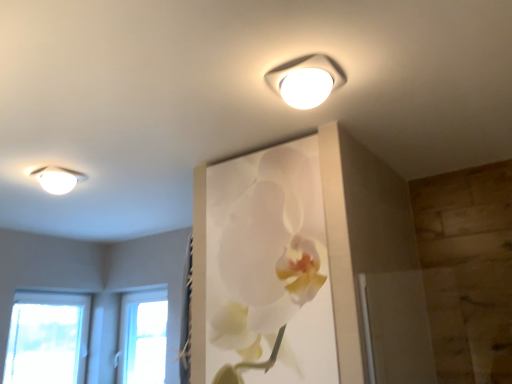
Identify the location of white plastic lamp at upper center, placed as the first lamp when sorted from right to left. The image size is (512, 384). (306, 80).

The height and width of the screenshot is (384, 512). Identify the location of transparent glass window at lower left. (142, 338).

Locate an element on the screen. Image resolution: width=512 pixels, height=384 pixels. white glossy ceiling light at upper left, the first lamp in the left-to-right sequence is located at coordinates (58, 178).

The image size is (512, 384). I want to click on white matte orchid at upper center, so click(269, 266).

Image resolution: width=512 pixels, height=384 pixels. What are the coordinates of `white plastic lamp at upper center, positioned as the second lamp in back-to-front order` in the screenshot? It's located at (306, 80).

From the picture: From a real-world perspective, who is located higher, white glossy ceiling light at upper left, the first lamp in the left-to-right sequence, or transparent glass window at lower left?

From a 3D spatial view, white glossy ceiling light at upper left, the first lamp in the left-to-right sequence, is above.

Is white glossy ceiling light at upper left, which is counted as the 1th lamp, starting from the bottom, facing towards transparent glass window at lower left?

No, white glossy ceiling light at upper left, which is counted as the 1th lamp, starting from the bottom, does not turn towards transparent glass window at lower left.

In terms of height, does white glossy ceiling light at upper left, the first lamp in the left-to-right sequence, look taller or shorter compared to transparent glass window at lower left?

In the image, white glossy ceiling light at upper left, the first lamp in the left-to-right sequence, appears to be shorter than transparent glass window at lower left.

From the image's perspective, between white glossy ceiling light at upper left, which is counted as the 1th lamp, starting from the bottom, and transparent glass window at lower left, who is located below?

transparent glass window at lower left.

Considering the sizes of objects white glossy ceiling light at upper left, the second lamp in the right-to-left sequence, and white matte orchid at upper center in the image provided, who is bigger, white glossy ceiling light at upper left, the second lamp in the right-to-left sequence, or white matte orchid at upper center?

With larger size is white matte orchid at upper center.

From a real-world perspective, starting from the white matte orchid at upper center, which lamp is the 1st one vertically above it? Please provide its 2D coordinates.

[(58, 178)]

Which object is closer to the camera taking this photo, white glossy ceiling light at upper left, the second lamp in the right-to-left sequence, or white matte orchid at upper center?

white matte orchid at upper center.

Based on the photo, does white glossy ceiling light at upper left, the 2th lamp from the front, contain white matte orchid at upper center?

No, white matte orchid at upper center is not surrounded by white glossy ceiling light at upper left, the 2th lamp from the front.

Is transparent glass window at lower left not near white glossy ceiling light at upper left, the first lamp in the left-to-right sequence?

transparent glass window at lower left is far away from white glossy ceiling light at upper left, the first lamp in the left-to-right sequence.

Is white glossy ceiling light at upper left, the 2th lamp from the front, inside transparent glass window at lower left?

No, white glossy ceiling light at upper left, the 2th lamp from the front, is not a part of transparent glass window at lower left.

Is transparent glass window at lower left shorter than white glossy ceiling light at upper left, the first lamp in the left-to-right sequence?

No, transparent glass window at lower left is not shorter than white glossy ceiling light at upper left, the first lamp in the left-to-right sequence.

From the image's perspective, which one is positioned lower, transparent glass window at lower left or white glossy ceiling light at upper left, which is counted as the 1th lamp, starting from the bottom?

From the image's view, transparent glass window at lower left is below.

Is the depth of white glossy ceiling light at upper left, marked as the 2th lamp in a top-to-bottom arrangement, less than that of white plastic lamp at upper center, placed as the 2th lamp when sorted from bottom to top?

No, it is not.

In the scene shown: From the image's perspective, is white glossy ceiling light at upper left, the second lamp in the right-to-left sequence, above or below white plastic lamp at upper center, positioned as the 1th lamp in top-to-bottom order?

Based on their image positions, white glossy ceiling light at upper left, the second lamp in the right-to-left sequence, is located beneath white plastic lamp at upper center, positioned as the 1th lamp in top-to-bottom order.

Is white glossy ceiling light at upper left, which is counted as the 1th lamp, starting from the bottom, oriented away from white plastic lamp at upper center, the 2th lamp when ordered from left to right?

white glossy ceiling light at upper left, which is counted as the 1th lamp, starting from the bottom, does not have its back to white plastic lamp at upper center, the 2th lamp when ordered from left to right.

Which object is closer to the camera taking this photo, white matte orchid at upper center or white plastic lamp at upper center, placed as the 2th lamp when sorted from bottom to top?

white plastic lamp at upper center, placed as the 2th lamp when sorted from bottom to top, is in front.

Is white matte orchid at upper center next to white plastic lamp at upper center, placed as the first lamp when sorted from right to left?

There is a gap between white matte orchid at upper center and white plastic lamp at upper center, placed as the first lamp when sorted from right to left.

Can you confirm if white matte orchid at upper center is thinner than white plastic lamp at upper center, placed as the 2th lamp when sorted from bottom to top?

Yes, white matte orchid at upper center is thinner than white plastic lamp at upper center, placed as the 2th lamp when sorted from bottom to top.

Locate an element on the screen. The height and width of the screenshot is (384, 512). lamp in front of the white matte orchid at upper center is located at coordinates (306, 80).

Considering the relative positions of white plastic lamp at upper center, arranged as the first lamp when viewed from the front, and white glossy ceiling light at upper left, the 2th lamp from the front, in the image provided, is white plastic lamp at upper center, arranged as the first lamp when viewed from the front, to the left of white glossy ceiling light at upper left, the 2th lamp from the front, from the viewer's perspective?

Incorrect, white plastic lamp at upper center, arranged as the first lamp when viewed from the front, is not on the left side of white glossy ceiling light at upper left, the 2th lamp from the front.

In the scene shown: Can you confirm if white plastic lamp at upper center, arranged as the first lamp when viewed from the front, is bigger than white glossy ceiling light at upper left, which is counted as the 1th lamp, starting from the bottom?

Correct, white plastic lamp at upper center, arranged as the first lamp when viewed from the front, is larger in size than white glossy ceiling light at upper left, which is counted as the 1th lamp, starting from the bottom.

Is the surface of white plastic lamp at upper center, placed as the first lamp when sorted from right to left, in direct contact with white glossy ceiling light at upper left, marked as the 2th lamp in a top-to-bottom arrangement?

No, white plastic lamp at upper center, placed as the first lamp when sorted from right to left, is not next to white glossy ceiling light at upper left, marked as the 2th lamp in a top-to-bottom arrangement.

Which point is more forward, (268,74) or (61,170)?

The point (268,74) is more forward.

Can you tell me how much white matte orchid at upper center and white glossy ceiling light at upper left, the 2th lamp from the front, differ in facing direction?

88.4 degrees separate the facing orientations of white matte orchid at upper center and white glossy ceiling light at upper left, the 2th lamp from the front.

Does white matte orchid at upper center contain white glossy ceiling light at upper left, the 1th lamp when ordered from back to front?

No, white glossy ceiling light at upper left, the 1th lamp when ordered from back to front, is not a part of white matte orchid at upper center.

Are white matte orchid at upper center and white glossy ceiling light at upper left, the second lamp in the right-to-left sequence, located far from each other?

Indeed, white matte orchid at upper center is not near white glossy ceiling light at upper left, the second lamp in the right-to-left sequence.

Is white matte orchid at upper center positioned with its back to white glossy ceiling light at upper left, marked as the 2th lamp in a top-to-bottom arrangement?

No.

Find the location of `window to the right of white glossy ceiling light at upper left, marked as the 2th lamp in a top-to-bottom arrangement`. window to the right of white glossy ceiling light at upper left, marked as the 2th lamp in a top-to-bottom arrangement is located at coordinates coord(142,338).

The height and width of the screenshot is (384, 512). Identify the location of lamp located on the left of white matte orchid at upper center. (58, 178).

Looking at the image, which one is located further to white plastic lamp at upper center, arranged as the first lamp when viewed from the front, white glossy ceiling light at upper left, which is counted as the 1th lamp, starting from the bottom, or transparent glass window at lower left?

Based on the image, transparent glass window at lower left appears to be further to white plastic lamp at upper center, arranged as the first lamp when viewed from the front.

Estimate the real-world distances between objects in this image. Which object is further from transparent glass window at lower left, white plastic lamp at upper center, positioned as the 1th lamp in top-to-bottom order, or white glossy ceiling light at upper left, the 2th lamp from the front?

The object further to transparent glass window at lower left is white plastic lamp at upper center, positioned as the 1th lamp in top-to-bottom order.

When comparing their distances from white plastic lamp at upper center, arranged as the first lamp when viewed from the front, does transparent glass window at lower left or white glossy ceiling light at upper left, the first lamp in the left-to-right sequence, seem further?

The object further to white plastic lamp at upper center, arranged as the first lamp when viewed from the front, is transparent glass window at lower left.

Looking at the image, which one is located closer to transparent glass window at lower left, white glossy ceiling light at upper left, the first lamp in the left-to-right sequence, or white matte orchid at upper center?

white glossy ceiling light at upper left, the first lamp in the left-to-right sequence, lies closer to transparent glass window at lower left than the other object.

When comparing their distances from transparent glass window at lower left, does white matte orchid at upper center or white glossy ceiling light at upper left, the 2th lamp from the front, seem further?

white matte orchid at upper center is further to transparent glass window at lower left.

From the image, which object appears to be farther from white glossy ceiling light at upper left, which is counted as the 1th lamp, starting from the bottom, transparent glass window at lower left or white plastic lamp at upper center, placed as the 2th lamp when sorted from bottom to top?

The object further to white glossy ceiling light at upper left, which is counted as the 1th lamp, starting from the bottom, is transparent glass window at lower left.

Based on their spatial positions, is transparent glass window at lower left or white matte orchid at upper center closer to white glossy ceiling light at upper left, marked as the 2th lamp in a top-to-bottom arrangement?

white matte orchid at upper center lies closer to white glossy ceiling light at upper left, marked as the 2th lamp in a top-to-bottom arrangement, than the other object.

From the image, which object appears to be nearer to white matte orchid at upper center, transparent glass window at lower left or white plastic lamp at upper center, the 2th lamp when ordered from left to right?

white plastic lamp at upper center, the 2th lamp when ordered from left to right, is positioned closer to the anchor white matte orchid at upper center.

At what (x,y) coordinates should I click in order to perform the action: click on lamp between white plastic lamp at upper center, positioned as the second lamp in back-to-front order, and transparent glass window at lower left, along the z-axis. Please return your answer as a coordinate pair (x, y). The width and height of the screenshot is (512, 384). Looking at the image, I should click on (58, 178).

Locate an element on the screen. The image size is (512, 384). floral arrangement located between white glossy ceiling light at upper left, the second lamp in the right-to-left sequence, and white plastic lamp at upper center, the 2th lamp when ordered from left to right, in the left-right direction is located at coordinates [269, 266].

Find the location of a particular element. The width and height of the screenshot is (512, 384). floral arrangement between white plastic lamp at upper center, placed as the 2th lamp when sorted from bottom to top, and transparent glass window at lower left from front to back is located at coordinates (269, 266).

Where is `lamp located between white matte orchid at upper center and transparent glass window at lower left in the depth direction`? The image size is (512, 384). lamp located between white matte orchid at upper center and transparent glass window at lower left in the depth direction is located at coordinates (58, 178).